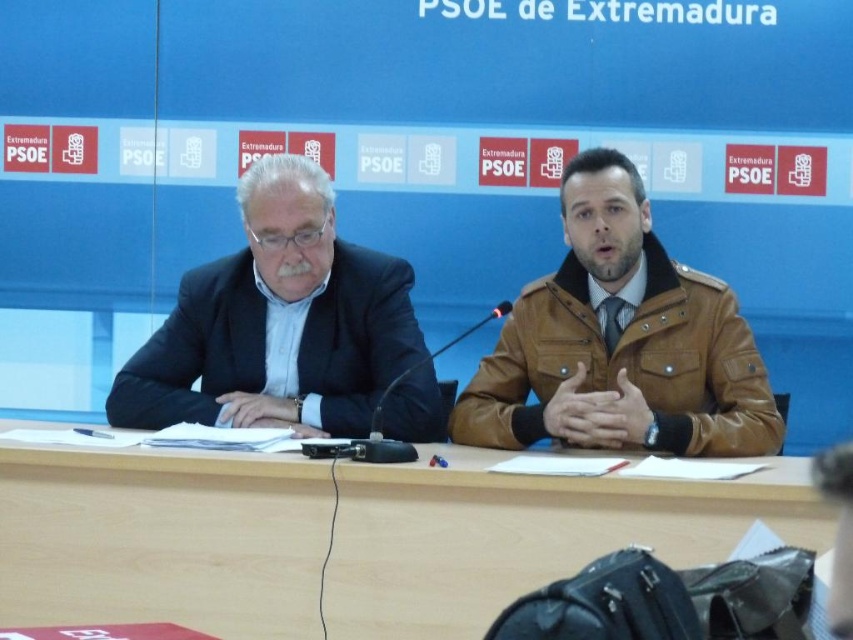
Describe the element at coordinates (161, 538) in the screenshot. The height and width of the screenshot is (640, 853). I see `wooden table at center` at that location.

Can you confirm if wooden table at center is smaller than matte black suit at left?

No.

Which is in front, point (213, 627) or point (235, 397)?

Positioned in front is point (213, 627).

Find the location of `wooden table at center`. wooden table at center is located at coordinates (161, 538).

Can you confirm if wooden table at center is shorter than brown leather jacket at center?

Yes, wooden table at center is shorter than brown leather jacket at center.

Does wooden table at center appear under brown leather jacket at center?

Yes.

In order to click on wooden table at center in this screenshot , I will do `click(161, 538)`.

Locate an element on the screen. The image size is (853, 640). wooden table at center is located at coordinates (161, 538).

From the picture: Is brown leather jacket at center shorter than matte black suit at left?

In fact, brown leather jacket at center may be taller than matte black suit at left.

In order to click on brown leather jacket at center in this screenshot , I will do `click(619, 340)`.

Describe the element at coordinates (619, 340) in the screenshot. I see `brown leather jacket at center` at that location.

The image size is (853, 640). I want to click on brown leather jacket at center, so click(x=619, y=340).